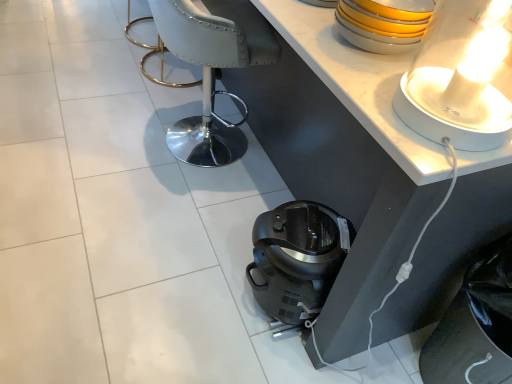
Question: Is white leather armchair at center taller than white glossy lamp at upper right?

Choices:
 (A) yes
 (B) no

Answer: (A)

Question: Considering the relative sizes of white leather armchair at center and white glossy lamp at upper right in the image provided, is white leather armchair at center smaller than white glossy lamp at upper right?

Choices:
 (A) yes
 (B) no

Answer: (B)

Question: Is white leather armchair at center turned away from white glossy lamp at upper right?

Choices:
 (A) no
 (B) yes

Answer: (A)

Question: From the image's perspective, is white leather armchair at center above white glossy lamp at upper right?

Choices:
 (A) yes
 (B) no

Answer: (A)

Question: Does white leather armchair at center have a lesser width compared to white glossy lamp at upper right?

Choices:
 (A) yes
 (B) no

Answer: (B)

Question: Could white glossy lamp at upper right be considered to be inside white leather armchair at center?

Choices:
 (A) no
 (B) yes

Answer: (A)

Question: Can you confirm if white glossy lamp at upper right is positioned to the left of yellow glossy bowls at upper right?

Choices:
 (A) no
 (B) yes

Answer: (A)

Question: Can you confirm if white glossy lamp at upper right is taller than yellow glossy bowls at upper right?

Choices:
 (A) yes
 (B) no

Answer: (A)

Question: Is white glossy lamp at upper right smaller than yellow glossy bowls at upper right?

Choices:
 (A) yes
 (B) no

Answer: (B)

Question: Could you tell me if white glossy lamp at upper right is turned towards yellow glossy bowls at upper right?

Choices:
 (A) no
 (B) yes

Answer: (A)

Question: Is white glossy lamp at upper right placed right next to yellow glossy bowls at upper right?

Choices:
 (A) no
 (B) yes

Answer: (A)

Question: From a real-world perspective, is white glossy lamp at upper right beneath yellow glossy bowls at upper right?

Choices:
 (A) yes
 (B) no

Answer: (B)

Question: Is white leather armchair at center inside white glossy table at upper center?

Choices:
 (A) no
 (B) yes

Answer: (A)